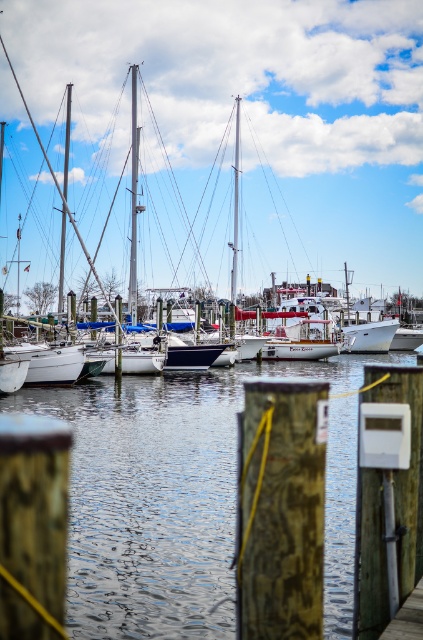
Is white matte sailboat at left smaller than clear water at center?

No, white matte sailboat at left is not smaller than clear water at center.

Who is more forward, (x=390, y=212) or (x=131, y=417)?

Point (x=131, y=417)

Is point (285, 237) farther from viewer compared to point (167, 596)?

Yes, it is.

What are the coordinates of `white matte sailboat at left` in the screenshot? It's located at (242, 124).

Who is more distant from viewer, (249, 141) or (415, 627)?

Point (249, 141)

Based on the photo, who is positioned more to the right, white matte sailboat at left or wooden dock at lower right?

Positioned to the right is wooden dock at lower right.

Is point (147, 32) closer to viewer compared to point (390, 630)?

No, (147, 32) is behind (390, 630).

Identify the location of white matte sailboat at left. (242, 124).

Which is more to the right, clear water at center or wooden dock at lower right?

From the viewer's perspective, wooden dock at lower right appears more on the right side.

Which of these two, clear water at center or wooden dock at lower right, stands shorter?

With less height is wooden dock at lower right.

Measure the distance between point (236, 396) and camera.

The distance of point (236, 396) from camera is 30.68 meters.

Identify the location of clear water at center. The height and width of the screenshot is (640, 423). (161, 493).